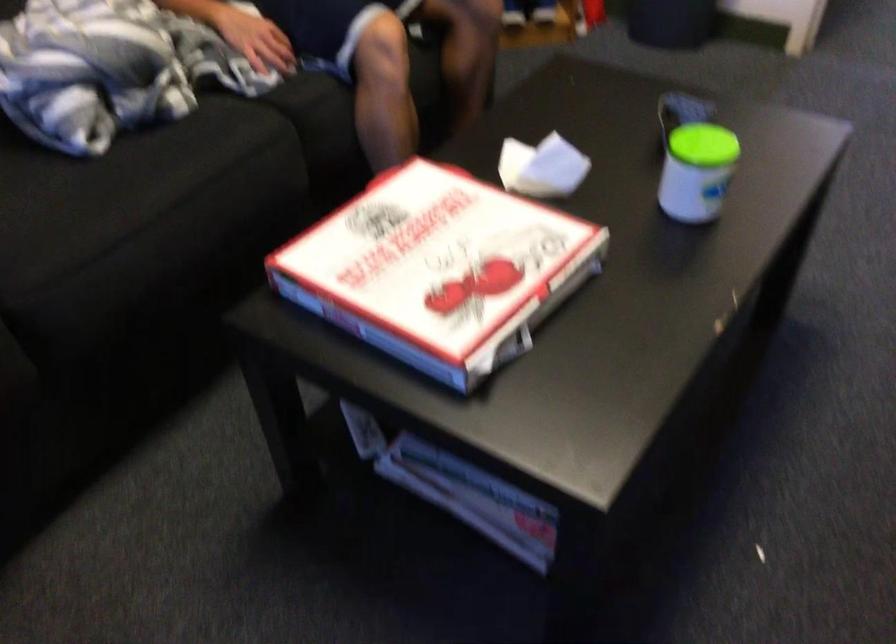
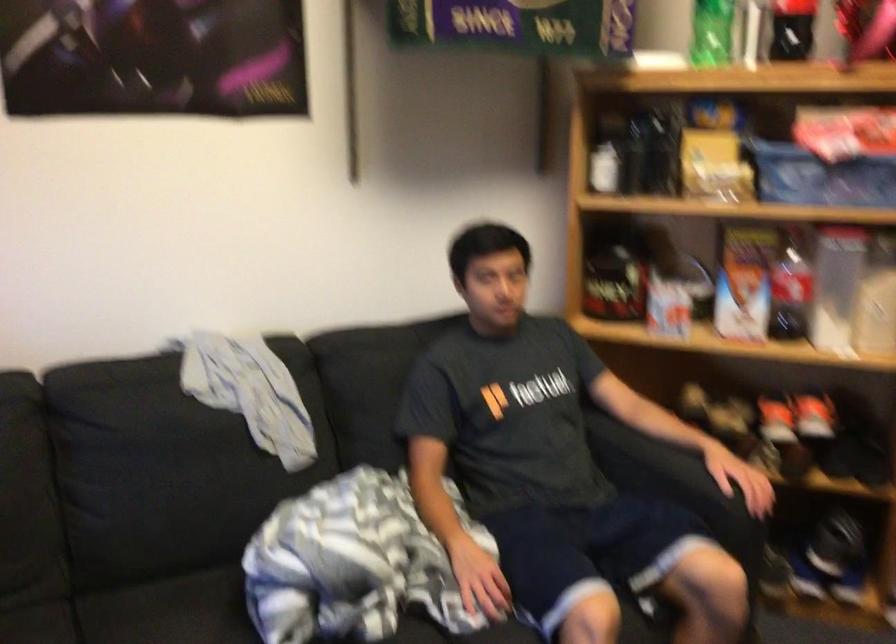
Based on the continuous images, in which direction is the camera rotating?

The rotation direction of the camera is left-up.